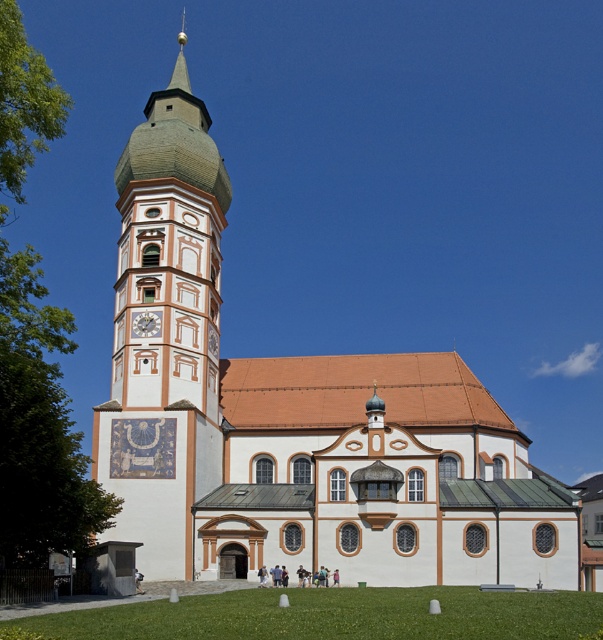
Question: Which point appears closest to the camera in this image?

Choices:
 (A) (145, 324)
 (B) (207, 458)

Answer: (B)

Question: Which point is closer to the camera?

Choices:
 (A) (194, 148)
 (B) (160, 312)

Answer: (B)

Question: Which point is farther from the camera taking this photo?

Choices:
 (A) (130, 401)
 (B) (139, 330)

Answer: (B)

Question: In this image, where is matte white tower at left located relative to matte white clock at center-left?

Choices:
 (A) below
 (B) above

Answer: (B)

Question: Is matte white tower at left wider than matte white clock at center-left?

Choices:
 (A) no
 (B) yes

Answer: (B)

Question: From the image, what is the correct spatial relationship of matte white tower at left in relation to matte white clock at center-left?

Choices:
 (A) below
 (B) above

Answer: (B)